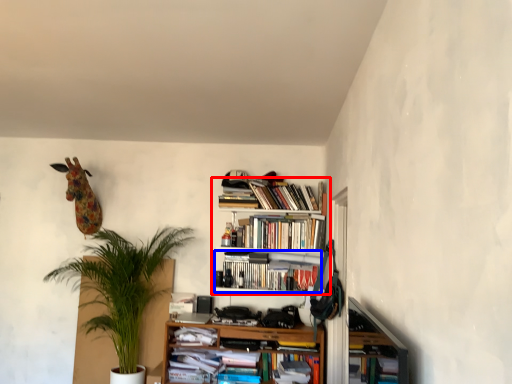
Question: Among these objects, which one is farthest to the camera, bookcase (highlighted by a red box) or book (highlighted by a blue box)?

Choices:
 (A) bookcase
 (B) book

Answer: (B)